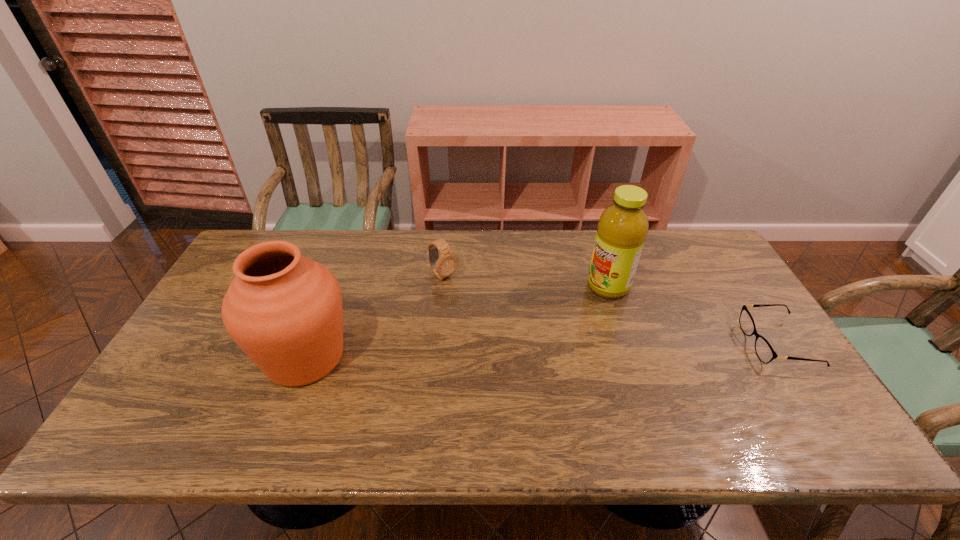
What are the coordinates of `free space at the far edge of the desktop` in the screenshot? It's located at (330, 244).

Identify the location of vacant space at the near edge. This screenshot has height=540, width=960. (520, 413).

You are a GUI agent. You are given a task and a screenshot of the screen. Output one action in this format:
    pyautogui.click(x=<x>, y=<y>)
    Task: Click on the vacant region at the left edge
    
    Given the screenshot: What is the action you would take?
    pyautogui.click(x=163, y=377)

In the image, there is a desktop. Identify the location of vacant space at the near left corner. The image size is (960, 540). (167, 397).

The image size is (960, 540). What are the coordinates of `vacant point located between the third tallest object and the fruit juice` in the screenshot? It's located at (526, 281).

Identify the location of unoccupied area between the spectacles and the third object from left to right. point(693,315).

At what (x,y) coordinates should I click in order to perform the action: click on unoccupied area between the fruit juice and the shortest object. Please return your answer as a coordinate pair (x, y). This screenshot has width=960, height=540. Looking at the image, I should click on (693, 315).

Locate an element on the screen. This screenshot has height=540, width=960. free space between the leftmost object and the spectacles is located at coordinates (541, 350).

Where is `unoccupied position between the third object from left to right and the rightmost object`? Image resolution: width=960 pixels, height=540 pixels. unoccupied position between the third object from left to right and the rightmost object is located at coordinates (693, 315).

The height and width of the screenshot is (540, 960). In order to click on empty space between the urn and the second shortest object in this screenshot , I will do `click(374, 316)`.